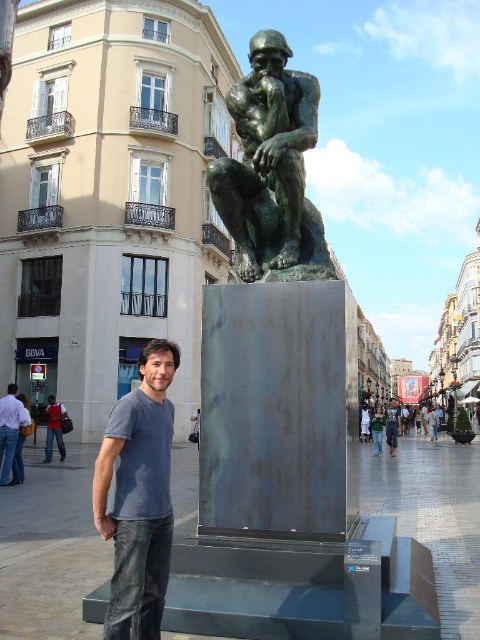
You are a photographer trying to capture the bronze statue at center and the gray cotton shirt at center in the same frame. Which object should you focus on first if you want to ensure both are in focus?

The bronze statue at center is bigger than the gray cotton shirt at center, so you should focus on the bronze statue at center first to ensure both are in focus.

You are a photographer trying to capture a clear shot of both the bronze statue at center and the blue denim jeans at lower left. Which object will appear closer to the camera in the photo?

The bronze statue at center will appear closer to the camera because it is further to the viewer than the blue denim jeans at lower left, meaning it occupies a more foreground position in the image.

Consider the image. You are a photographer trying to capture a closeup of both the blue denim jeans at lower left and the gray cotton shirt at center. Since you want both items to appear equally sized in the photo, which object should you move closer to the camera?

Since the blue denim jeans at lower left is larger in size than the gray cotton shirt at center, you should move the blue denim jeans at lower left closer to the camera to make them appear smaller and balance their sizes in the photo.